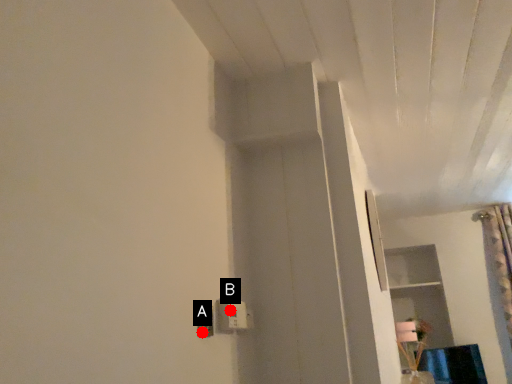
Question: Two points are circled on the image, labeled by A and B beside each circle. Which point is closer to the camera taking this photo?

Choices:
 (A) A is closer
 (B) B is closer

Answer: (A)